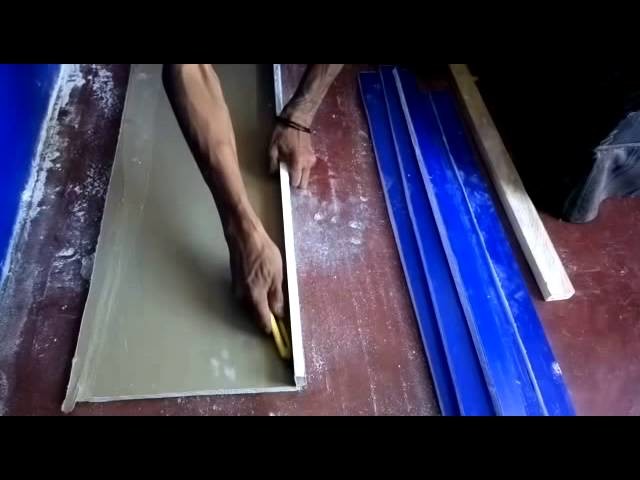
The image size is (640, 480). In order to click on fabric in this screenshot , I will do `click(620, 169)`.